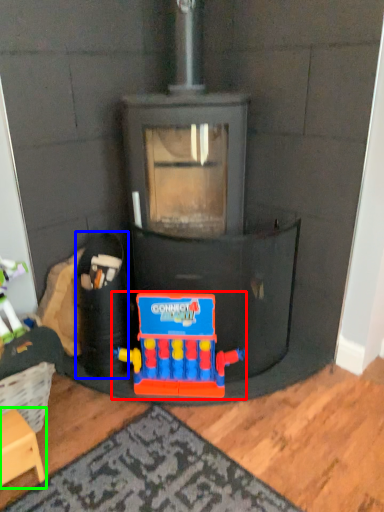
Question: Considering the real-world distances, which object is closest to toy (highlighted by a red box)? toy (highlighted by a blue box) or furniture (highlighted by a green box).

Choices:
 (A) toy
 (B) furniture

Answer: (A)